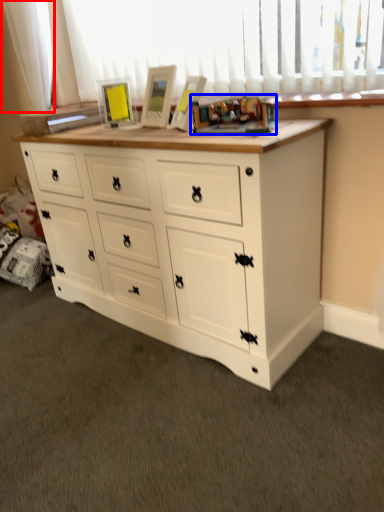
Question: Which object is closer to the camera taking this photo, curtain (highlighted by a red box) or toy (highlighted by a blue box)?

Choices:
 (A) curtain
 (B) toy

Answer: (B)